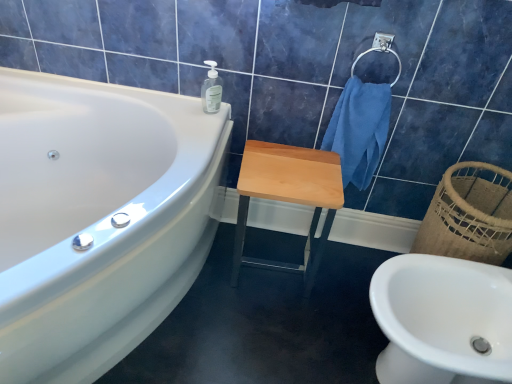
Describe the element at coordinates (211, 89) in the screenshot. I see `transparent plastic soap dispenser at upper center` at that location.

What do you see at coordinates (359, 130) in the screenshot? I see `blue cotton towel at upper right` at bounding box center [359, 130].

This screenshot has width=512, height=384. What do you see at coordinates (380, 51) in the screenshot?
I see `satin silver towel bar at upper right` at bounding box center [380, 51].

Where is `satin silver towel bar at upper right`? The height and width of the screenshot is (384, 512). satin silver towel bar at upper right is located at coordinates (380, 51).

You are a GUI agent. You are given a task and a screenshot of the screen. Output one action in this format:
    pyautogui.click(x=<x>, y=<y>)
    Task: Click on the white glossy bathtub at upper left
    The height and width of the screenshot is (384, 512).
    Given the screenshot: What is the action you would take?
    pyautogui.click(x=98, y=218)

Measure the distance between light wood/matte stool at center and camera.

light wood/matte stool at center and camera are 4.13 feet apart from each other.

Locate an element on the screen. The width and height of the screenshot is (512, 384). transparent plastic soap dispenser at upper center is located at coordinates (211, 89).

Choose the correct answer: Is transparent plastic soap dispenser at upper center inside white glossy sink at lower right or outside it?

transparent plastic soap dispenser at upper center is located beyond the bounds of white glossy sink at lower right.

Is there a large distance between transparent plastic soap dispenser at upper center and white glossy sink at lower right?

They are positioned close to each other.

From the image's perspective, does transparent plastic soap dispenser at upper center appear higher than white glossy sink at lower right?

Yes, from the image's perspective, transparent plastic soap dispenser at upper center is over white glossy sink at lower right.

Does transparent plastic soap dispenser at upper center have a greater width compared to white glossy sink at lower right?

No.

Can you confirm if satin silver towel bar at upper right is smaller than white glossy bathtub at upper left?

Yes.

Is satin silver towel bar at upper right positioned in front of white glossy bathtub at upper left?

No, the depth of satin silver towel bar at upper right is greater than that of white glossy bathtub at upper left.

What's the angular difference between satin silver towel bar at upper right and white glossy bathtub at upper left's facing directions?

The angle between the facing direction of satin silver towel bar at upper right and the facing direction of white glossy bathtub at upper left is 0.164 degrees.

Does satin silver towel bar at upper right touch white glossy bathtub at upper left?

No, satin silver towel bar at upper right is not touching white glossy bathtub at upper left.

Considering their positions, is blue cotton towel at upper right located in front of or behind transparent plastic soap dispenser at upper center?

In the image, blue cotton towel at upper right appears in front of transparent plastic soap dispenser at upper center.

Considering the positions of objects blue cotton towel at upper right and transparent plastic soap dispenser at upper center in the image provided, who is more to the right, blue cotton towel at upper right or transparent plastic soap dispenser at upper center?

blue cotton towel at upper right.

From the image's perspective, is blue cotton towel at upper right below transparent plastic soap dispenser at upper center?

Indeed, from the image's perspective, blue cotton towel at upper right is shown beneath transparent plastic soap dispenser at upper center.

Based on the photo, how different are the orientations of blue cotton towel at upper right and transparent plastic soap dispenser at upper center in degrees?

blue cotton towel at upper right and transparent plastic soap dispenser at upper center are facing 0.000305 degrees away from each other.

Does white glossy bathtub at upper left appear on the right side of blue cotton towel at upper right?

Incorrect, white glossy bathtub at upper left is not on the right side of blue cotton towel at upper right.

Considering the positions of objects white glossy bathtub at upper left and blue cotton towel at upper right in the image provided, who is in front, white glossy bathtub at upper left or blue cotton towel at upper right?

Positioned in front is white glossy bathtub at upper left.

Is point (161, 269) farther from viewer compared to point (345, 128)?

No, (161, 269) is in front of (345, 128).

Can you tell me how much white glossy bathtub at upper left and blue cotton towel at upper right differ in facing direction?

The angular difference between white glossy bathtub at upper left and blue cotton towel at upper right is 0.164 degrees.

Consider the image. From a real-world perspective, is blue cotton towel at upper right positioned above or below white glossy bathtub at upper left?

blue cotton towel at upper right is above white glossy bathtub at upper left.

Considering the positions of objects blue cotton towel at upper right and white glossy bathtub at upper left in the image provided, who is more to the left, blue cotton towel at upper right or white glossy bathtub at upper left?

white glossy bathtub at upper left is more to the left.

Is blue cotton towel at upper right spatially inside white glossy bathtub at upper left, or outside of it?

blue cotton towel at upper right is spatially situated outside white glossy bathtub at upper left.

Looking at this image, from the image's perspective, between light wood/matte stool at center and white glossy sink at lower right, which one is located above?

light wood/matte stool at center.

From a real-world perspective, is light wood/matte stool at center under white glossy sink at lower right?

No, from a real-world perspective, light wood/matte stool at center is not beneath white glossy sink at lower right.

Is light wood/matte stool at center to the left of white glossy sink at lower right from the viewer's perspective?

Correct, you'll find light wood/matte stool at center to the left of white glossy sink at lower right.

Considering the positions of objects transparent plastic soap dispenser at upper center and light wood/matte stool at center in the image provided, who is in front, transparent plastic soap dispenser at upper center or light wood/matte stool at center?

light wood/matte stool at center is closer to the camera.

Considering the sizes of objects transparent plastic soap dispenser at upper center and light wood/matte stool at center in the image provided, who is bigger, transparent plastic soap dispenser at upper center or light wood/matte stool at center?

light wood/matte stool at center is bigger.

Is transparent plastic soap dispenser at upper center directly adjacent to light wood/matte stool at center?

They are not placed beside each other.

Considering the positions of objects transparent plastic soap dispenser at upper center and light wood/matte stool at center in the image provided, who is more to the right, transparent plastic soap dispenser at upper center or light wood/matte stool at center?

light wood/matte stool at center is more to the right.

Where is `soap dispenser located above the white glossy sink at lower right (from the image's perspective)`? The width and height of the screenshot is (512, 384). soap dispenser located above the white glossy sink at lower right (from the image's perspective) is located at coordinates (211, 89).

This screenshot has width=512, height=384. In order to click on bathtub in front of the satin silver towel bar at upper right in this screenshot , I will do `click(98, 218)`.

From the picture: Estimate the real-world distances between objects in this image. Which object is closer to white glossy sink at lower right, satin silver towel bar at upper right or white glossy bathtub at upper left?

The object closer to white glossy sink at lower right is satin silver towel bar at upper right.

Based on their spatial positions, is blue cotton towel at upper right or white glossy sink at lower right further from white glossy bathtub at upper left?

white glossy sink at lower right is positioned further to the anchor white glossy bathtub at upper left.

Based on the photo, from the image, which object appears to be nearer to light wood/matte stool at center, transparent plastic soap dispenser at upper center or white glossy sink at lower right?

transparent plastic soap dispenser at upper center.

In the scene shown: Looking at the image, which one is located further to light wood/matte stool at center, transparent plastic soap dispenser at upper center or blue cotton towel at upper right?

transparent plastic soap dispenser at upper center is positioned further to the anchor light wood/matte stool at center.

Considering their positions, is light wood/matte stool at center positioned further to blue cotton towel at upper right than transparent plastic soap dispenser at upper center?

transparent plastic soap dispenser at upper center is positioned further to the anchor blue cotton towel at upper right.

Estimate the real-world distances between objects in this image. Which object is further from satin silver towel bar at upper right, blue cotton towel at upper right or transparent plastic soap dispenser at upper center?

transparent plastic soap dispenser at upper center is positioned further to the anchor satin silver towel bar at upper right.

Considering their positions, is white glossy bathtub at upper left positioned further to white glossy sink at lower right than satin silver towel bar at upper right?

white glossy bathtub at upper left is positioned further to the anchor white glossy sink at lower right.

Based on the photo, based on their spatial positions, is light wood/matte stool at center or transparent plastic soap dispenser at upper center further from white glossy bathtub at upper left?

Among the two, transparent plastic soap dispenser at upper center is located further to white glossy bathtub at upper left.

Where is `bath towel between white glossy bathtub at upper left and white glossy sink at lower right in the horizontal direction`? The width and height of the screenshot is (512, 384). bath towel between white glossy bathtub at upper left and white glossy sink at lower right in the horizontal direction is located at coordinates pyautogui.click(x=359, y=130).

This screenshot has width=512, height=384. I want to click on soap dispenser between white glossy bathtub at upper left and blue cotton towel at upper right in the horizontal direction, so click(211, 89).

The image size is (512, 384). I want to click on soap dispenser between white glossy bathtub at upper left and white glossy sink at lower right from left to right, so click(x=211, y=89).

This screenshot has width=512, height=384. I want to click on soap dispenser between white glossy bathtub at upper left and light wood/matte stool at center, so click(211, 89).